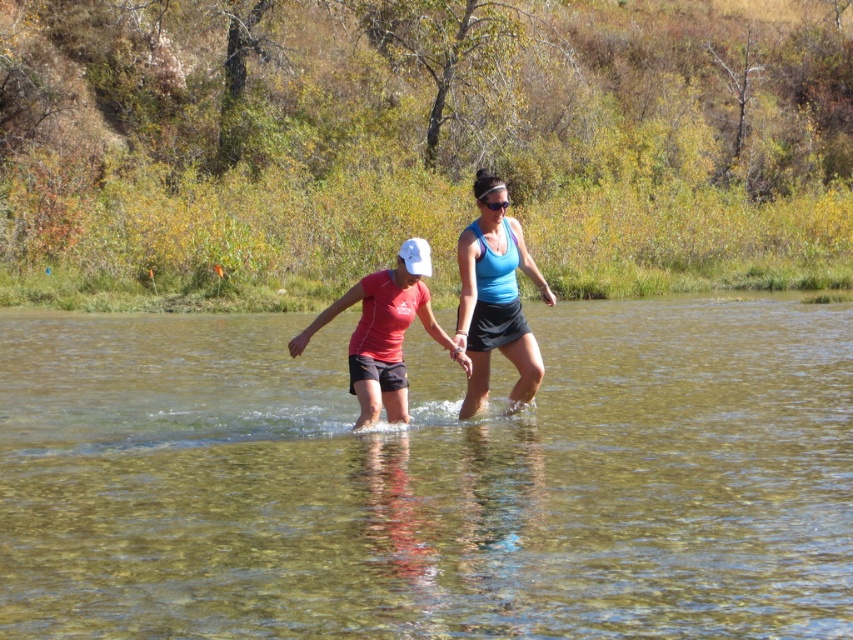
Question: Is matte red shirt at center in front of blue matte tank top at center?

Choices:
 (A) yes
 (B) no

Answer: (A)

Question: Which object is farther from the camera taking this photo?

Choices:
 (A) matte red shirt at center
 (B) clear water at center

Answer: (A)

Question: Does clear water at center have a lesser width compared to matte red shirt at center?

Choices:
 (A) no
 (B) yes

Answer: (A)

Question: Does clear water at center appear over matte red shirt at center?

Choices:
 (A) no
 (B) yes

Answer: (A)

Question: Which object appears farthest from the camera in this image?

Choices:
 (A) blue matte tank top at center
 (B) matte red shirt at center

Answer: (A)

Question: Considering the real-world distances, which object is closest to the matte red shirt at center?

Choices:
 (A) clear water at center
 (B) blue matte tank top at center

Answer: (B)